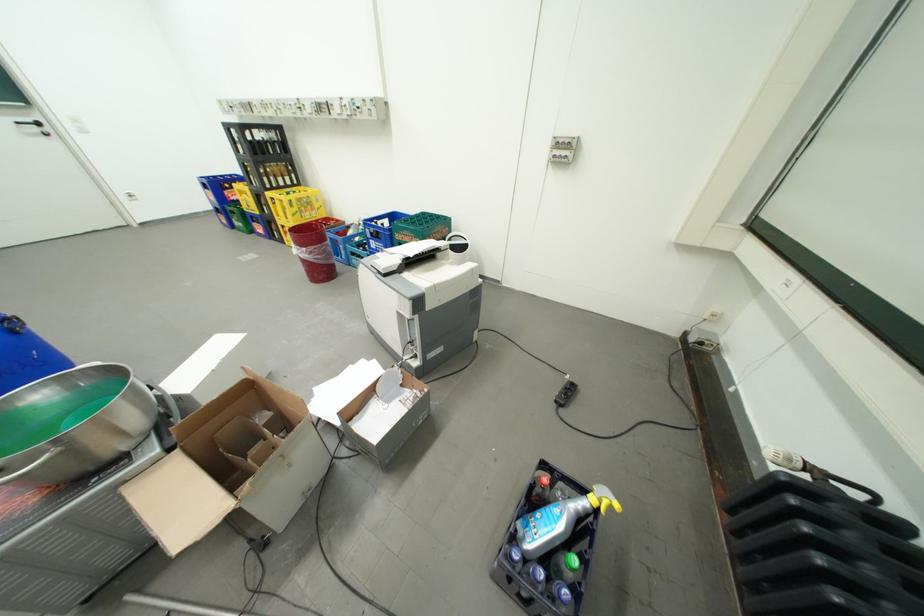
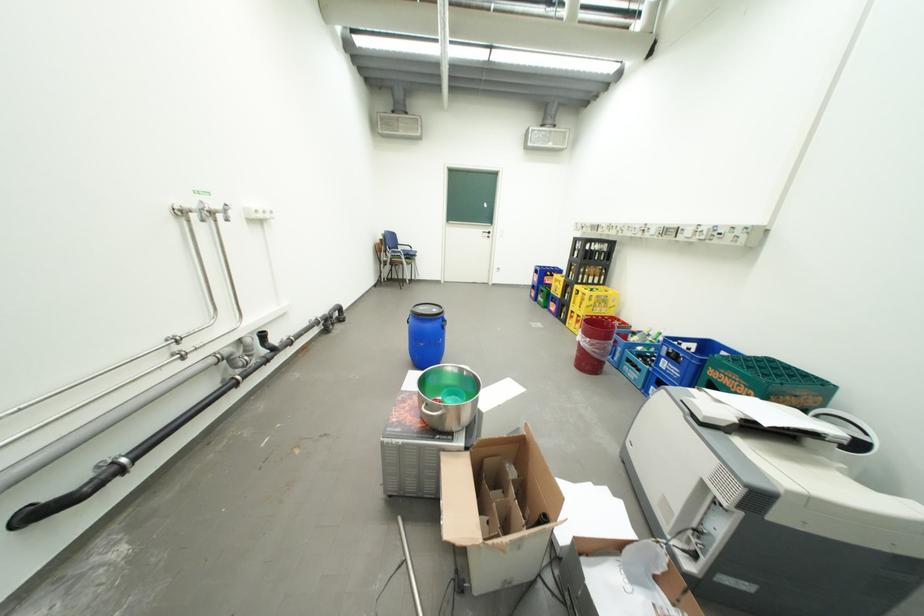
Locate, in the second image, the point that corresponds to pixel 299 223 in the first image.

(590, 312)